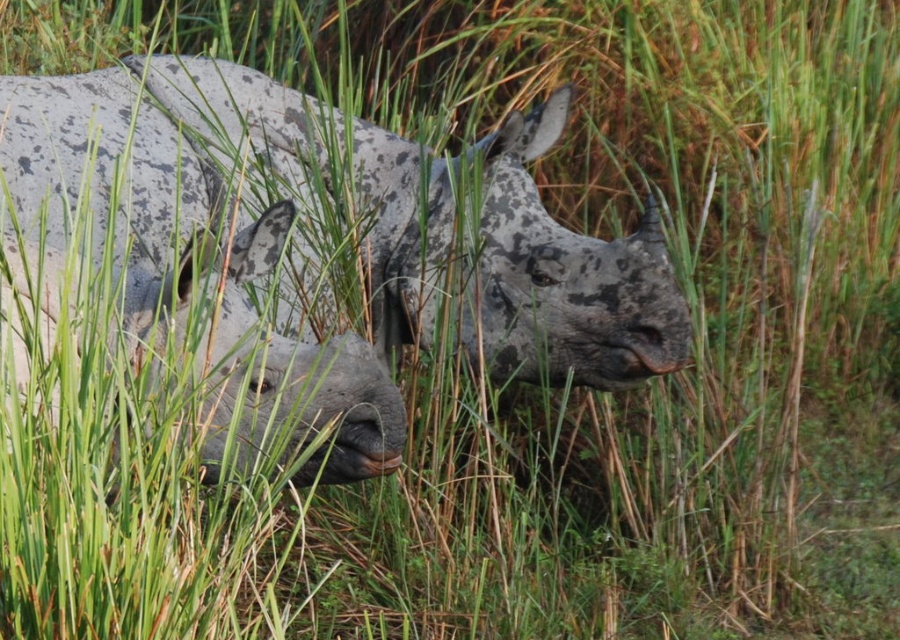
Is speckled gray rhinoceros at center bigger than gray textured rhino at left?

Indeed, speckled gray rhinoceros at center has a larger size compared to gray textured rhino at left.

Is speckled gray rhinoceros at center thinner than gray textured rhino at left?

In fact, speckled gray rhinoceros at center might be wider than gray textured rhino at left.

What are the coordinates of `speckled gray rhinoceros at center` in the screenshot? It's located at (156, 144).